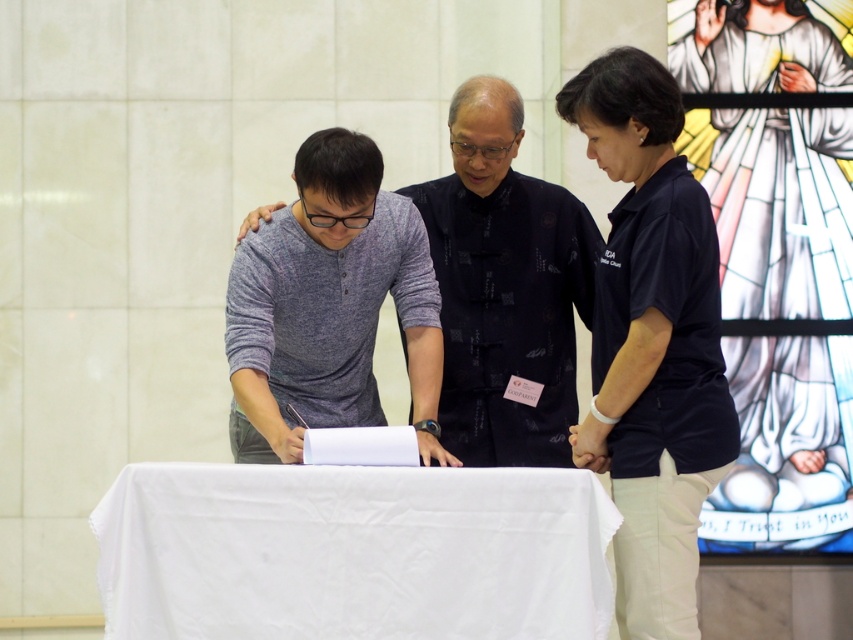
Question: Which point appears closest to the camera in this image?

Choices:
 (A) (439, 609)
 (B) (646, 145)
 (C) (310, 214)
 (D) (698, 472)

Answer: (A)

Question: Which point is closer to the camera?

Choices:
 (A) pos(722,442)
 (B) pos(306,419)
 (C) pos(222,588)
 (D) pos(636,248)

Answer: (C)

Question: Can you confirm if purple cotton shirt at center is bigger than gray cotton shirt at center?

Choices:
 (A) yes
 (B) no

Answer: (B)

Question: Is white cloth-covered table at center bigger than purple cotton shirt at center?

Choices:
 (A) yes
 (B) no

Answer: (B)

Question: Does white cloth-covered table at center have a lesser width compared to gray cotton shirt at center?

Choices:
 (A) no
 (B) yes

Answer: (A)

Question: Estimate the real-world distances between objects in this image. Which object is closer to the purple cotton shirt at center?

Choices:
 (A) white cloth-covered table at center
 (B) dark blue shirt at center

Answer: (B)